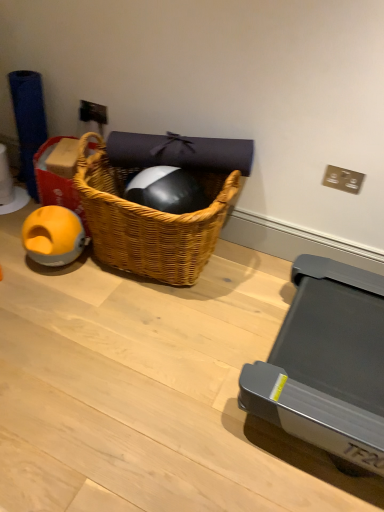
Where is `vacant space to the left of orange rubber ball at left`? Image resolution: width=384 pixels, height=512 pixels. vacant space to the left of orange rubber ball at left is located at coordinates (13, 257).